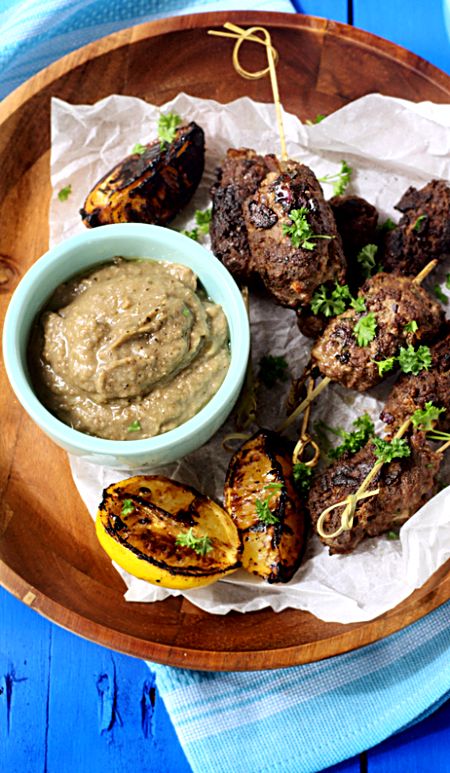
Locate an element on the screen. light blue napkin/towel is located at coordinates (248, 724).